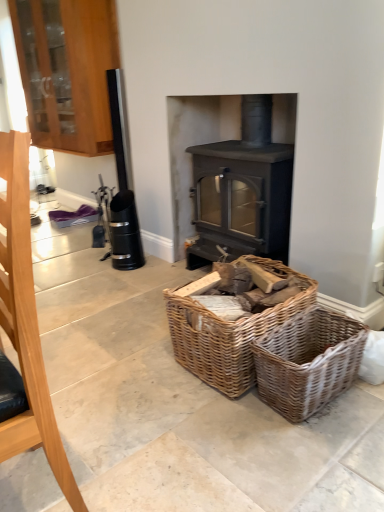
Question: Is wooden cabinet at upper left to the right of woven brown basket at lower center from the viewer's perspective?

Choices:
 (A) no
 (B) yes

Answer: (A)

Question: Is wooden cabinet at upper left shorter than woven brown basket at lower center?

Choices:
 (A) no
 (B) yes

Answer: (A)

Question: Is wooden cabinet at upper left next to woven brown basket at lower center?

Choices:
 (A) yes
 (B) no

Answer: (B)

Question: Is wooden cabinet at upper left further to camera compared to woven brown basket at lower center?

Choices:
 (A) yes
 (B) no

Answer: (A)

Question: Is wooden cabinet at upper left bigger than woven brown basket at lower center?

Choices:
 (A) yes
 (B) no

Answer: (A)

Question: Based on their sizes in the image, would you say brushed metal fireplace tool at left is bigger or smaller than matte gray wood burning stove at center?

Choices:
 (A) small
 (B) big

Answer: (A)

Question: Visually, is brushed metal fireplace tool at left positioned to the left or to the right of matte gray wood burning stove at center?

Choices:
 (A) right
 (B) left

Answer: (B)

Question: Relative to matte gray wood burning stove at center, is brushed metal fireplace tool at left in front or behind?

Choices:
 (A) behind
 (B) front

Answer: (B)

Question: From their relative heights in the image, would you say brushed metal fireplace tool at left is taller or shorter than matte gray wood burning stove at center?

Choices:
 (A) tall
 (B) short

Answer: (A)

Question: From the image's perspective, is brushed metal fireplace tool at left located above or below woven wood basket at center?

Choices:
 (A) above
 (B) below

Answer: (A)

Question: In terms of width, does brushed metal fireplace tool at left look wider or thinner when compared to woven wood basket at center?

Choices:
 (A) thin
 (B) wide

Answer: (A)

Question: From a real-world perspective, is brushed metal fireplace tool at left above or below woven wood basket at center?

Choices:
 (A) below
 (B) above

Answer: (B)

Question: Considering the positions of brushed metal fireplace tool at left and woven wood basket at center in the image, is brushed metal fireplace tool at left taller or shorter than woven wood basket at center?

Choices:
 (A) short
 (B) tall

Answer: (B)

Question: Does point (24, 211) appear closer or farther from the camera than point (264, 361)?

Choices:
 (A) closer
 (B) farther

Answer: (A)

Question: Based on their sizes in the image, would you say brushed metal fireplace tool at left is bigger or smaller than woven brown basket at lower center?

Choices:
 (A) big
 (B) small

Answer: (A)